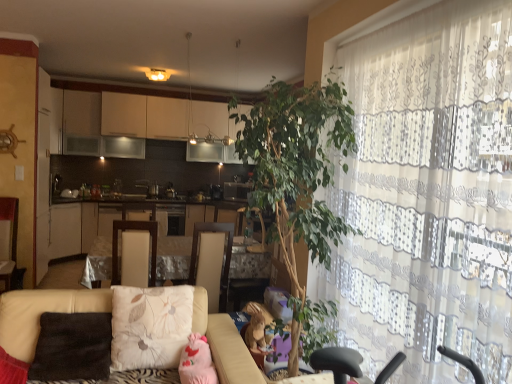
Question: Which direction should I rotate to face fluffy beige pillow at center, which is counted as the first pillow, starting from the right, — up or down?

Choices:
 (A) up
 (B) down

Answer: (B)

Question: Is green leafy plant at center taller than satin silver microwave at center?

Choices:
 (A) no
 (B) yes

Answer: (B)

Question: Does green leafy plant at center lie in front of satin silver microwave at center?

Choices:
 (A) yes
 (B) no

Answer: (A)

Question: Is green leafy plant at center oriented towards satin silver microwave at center?

Choices:
 (A) no
 (B) yes

Answer: (A)

Question: Is the position of green leafy plant at center more distant than that of satin silver microwave at center?

Choices:
 (A) no
 (B) yes

Answer: (A)

Question: Does green leafy plant at center have a larger size compared to satin silver microwave at center?

Choices:
 (A) yes
 (B) no

Answer: (A)

Question: Does green leafy plant at center have a smaller size compared to satin silver microwave at center?

Choices:
 (A) yes
 (B) no

Answer: (B)

Question: Is beige fabric swivel chair at center, the first swivel chair positioned from the right, located within brown fabric pillow at lower left, the second pillow from the right?

Choices:
 (A) yes
 (B) no

Answer: (B)

Question: Is brown fabric pillow at lower left, marked as the 1th pillow in a left-to-right arrangement, outside beige fabric swivel chair at center, marked as the 2th swivel chair in a left-to-right arrangement?

Choices:
 (A) no
 (B) yes

Answer: (B)

Question: Is brown fabric pillow at lower left, the second pillow from the right, to the left of beige fabric swivel chair at center, the first swivel chair positioned from the right, from the viewer's perspective?

Choices:
 (A) yes
 (B) no

Answer: (A)

Question: Is brown fabric pillow at lower left, marked as the 1th pillow in a left-to-right arrangement, smaller than beige fabric swivel chair at center, marked as the 2th swivel chair in a left-to-right arrangement?

Choices:
 (A) no
 (B) yes

Answer: (B)

Question: Can you confirm if brown fabric pillow at lower left, marked as the 1th pillow in a left-to-right arrangement, is taller than beige fabric swivel chair at center, marked as the 2th swivel chair in a left-to-right arrangement?

Choices:
 (A) yes
 (B) no

Answer: (B)

Question: Does brown fabric pillow at lower left, the second pillow from the right, touch beige fabric swivel chair at center, marked as the 2th swivel chair in a left-to-right arrangement?

Choices:
 (A) yes
 (B) no

Answer: (B)

Question: Is satin silver microwave at center located outside fluffy beige pillow at center, positioned as the second pillow in left-to-right order?

Choices:
 (A) no
 (B) yes

Answer: (B)